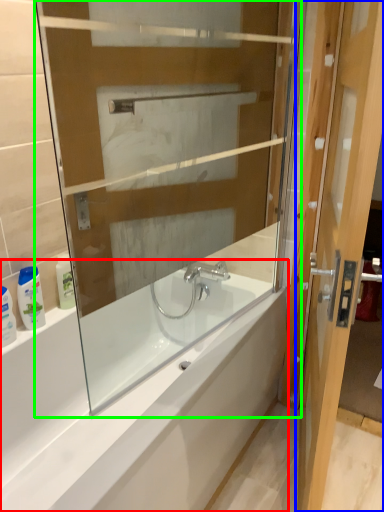
Question: Which is nearer to the bathtub (highlighted by a red box)? door (highlighted by a blue box) or glass box (highlighted by a green box).

Choices:
 (A) door
 (B) glass box

Answer: (B)